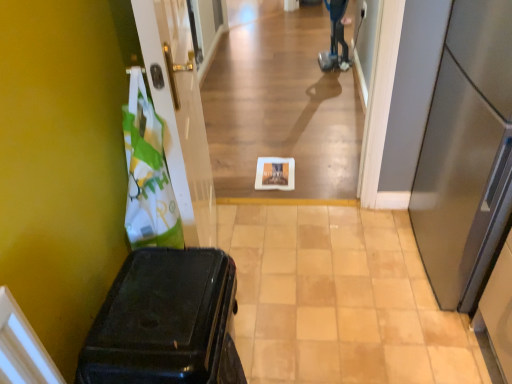
Locate an element on the screen. The image size is (512, 384). blank space situated above white glossy plate at center (from a real-world perspective) is located at coordinates (334, 278).